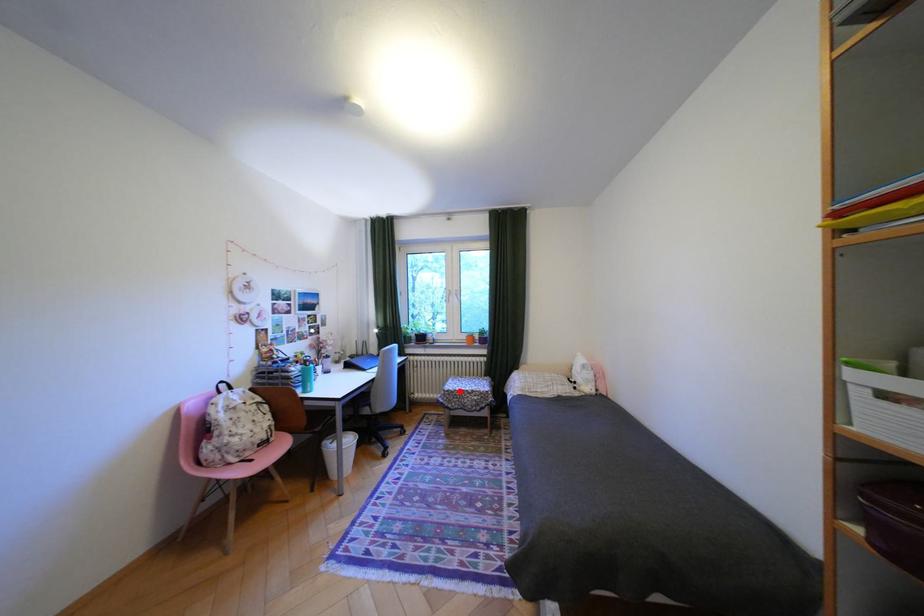
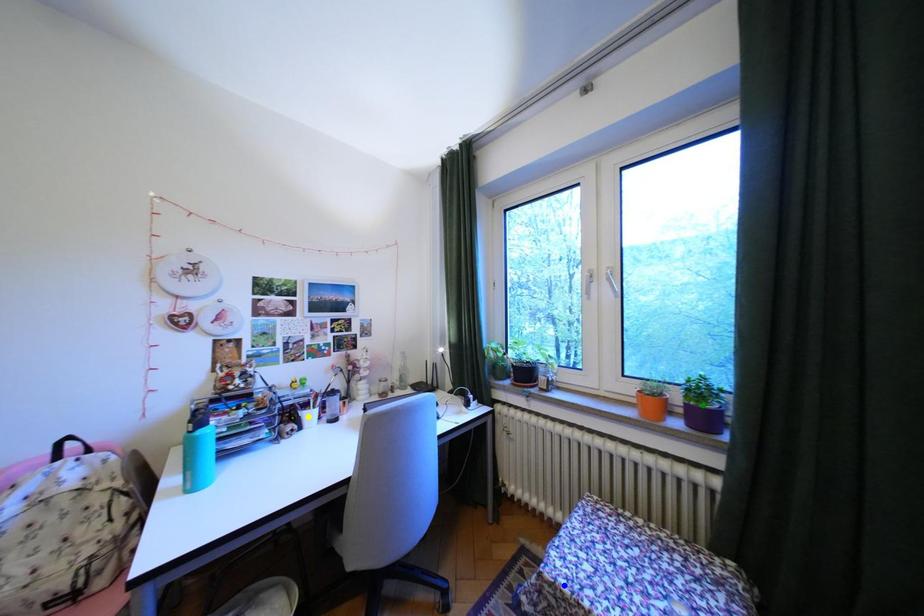
Question: I am providing you with two images of the same scene from different viewpoints. A red point is marked on the first image. You are given multiple points on the second image. Which spot in image 2 lines up with the point in image 1?

Choices:
 (A) yellow point
 (B) blue point
 (C) green point

Answer: (B)